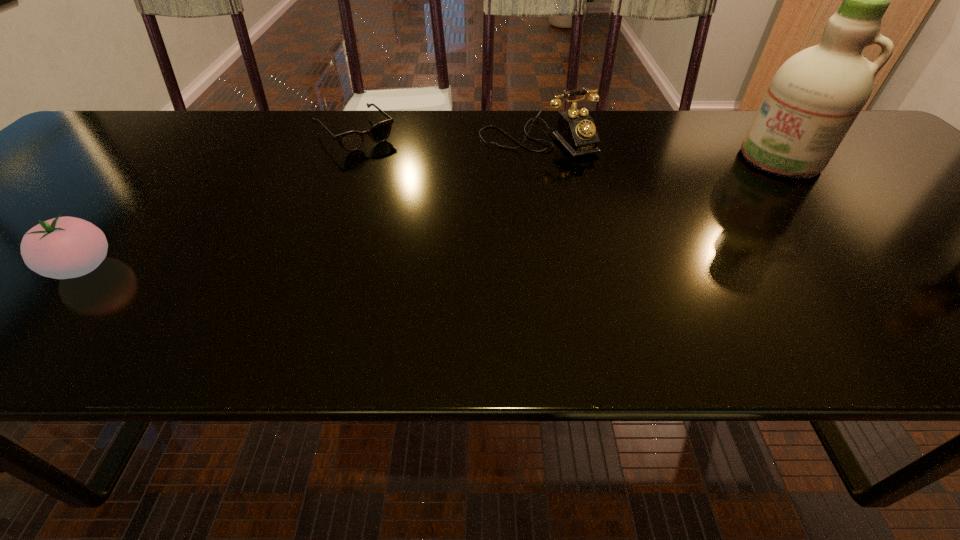
Locate which object is the second closest to the second shortest object. Please provide its 2D coordinates. Your answer should be formatted as a tuple, i.e. [(x, y)], where the tuple contains the x and y coordinates of a point satisfying the conditions above.

[(576, 131)]

This screenshot has height=540, width=960. Find the location of `object that stands as the third closest to the second shortest object`. object that stands as the third closest to the second shortest object is located at coordinates (814, 98).

Find the location of `vacant region that satisfies the following two spatial constraints: 1. on the front side of the telephone; 2. on the right side of the second object from left to right`. vacant region that satisfies the following two spatial constraints: 1. on the front side of the telephone; 2. on the right side of the second object from left to right is located at coordinates (353, 139).